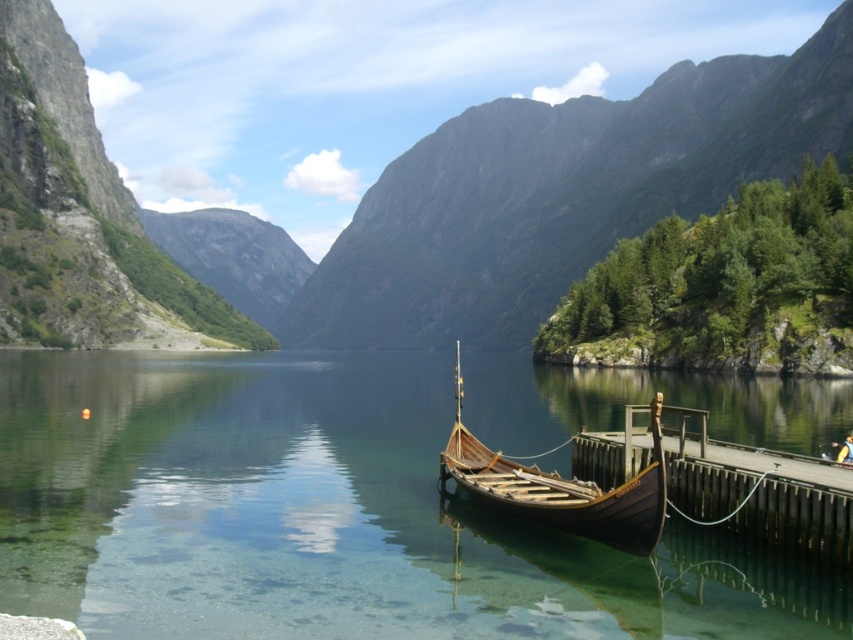
You are standing on the wooden dock and want to cross to the other side of the wooden viking ship at center. There is a small stepping stone path nearby. To your left, you notice the transparent water at boat right. Which direction should you go to avoid stepping into the water?

You should go to the right of the wooden viking ship at center to avoid stepping into the transparent water at boat right, since the water is located to the left of the ship.

You are a tour guide leading a group near the fjord. You want to inform your group about the distance between the transparent water at boat right and the brown wooden dock at lower right. What do you tell them?

The distance between the transparent water at boat right and the brown wooden dock at lower right is 96.42 feet.